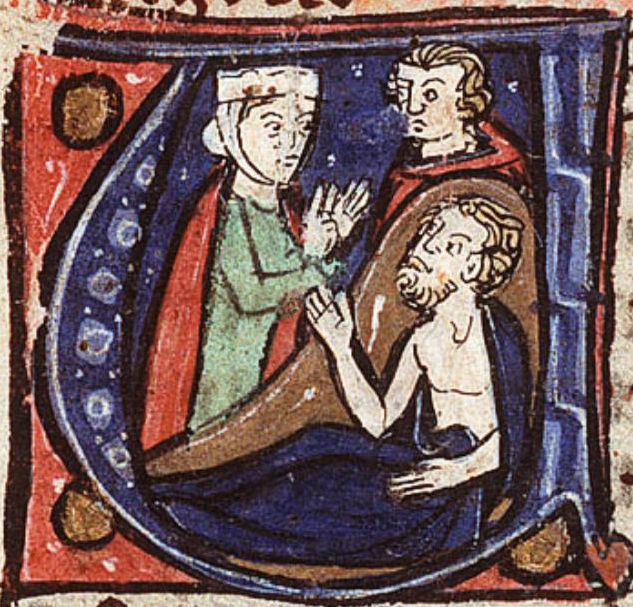
What are the coordinates of `blanket` in the screenshot? It's located at (318, 495).